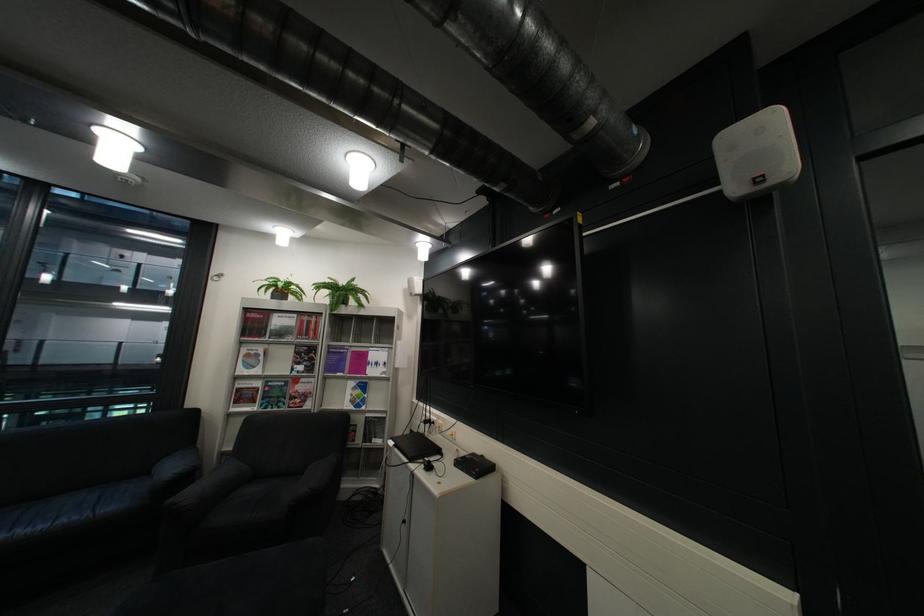
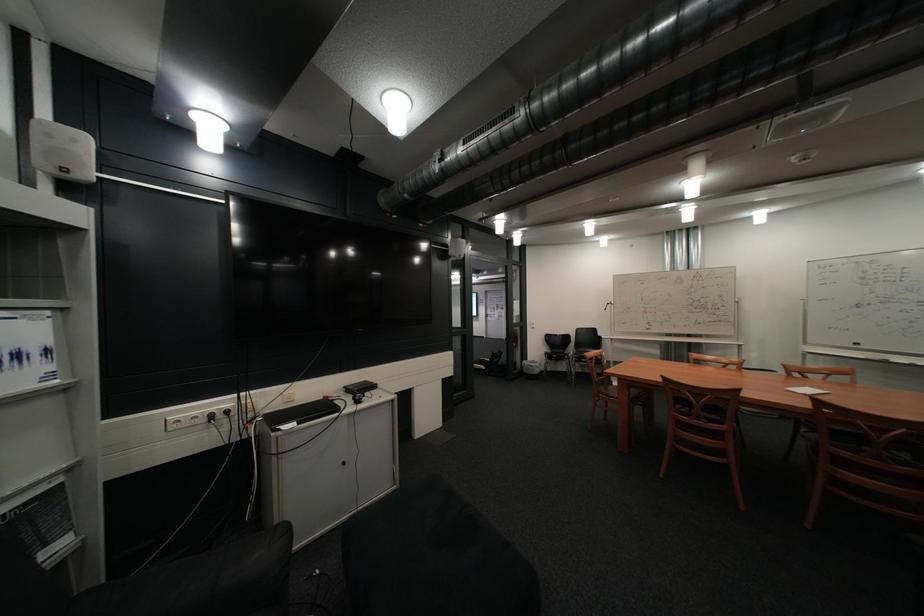
In the second image, find the point that corresponds to (x=393, y=375) in the first image.

(46, 386)